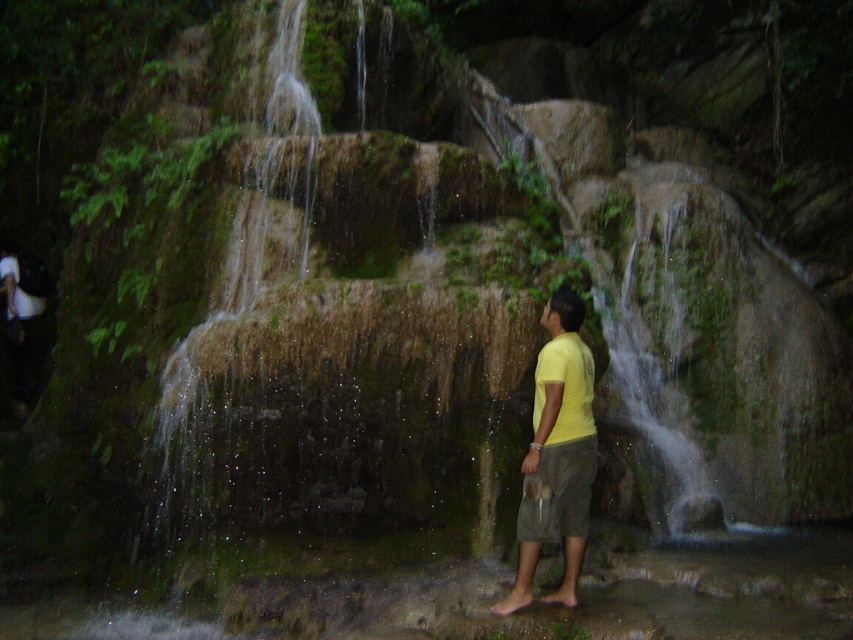
Question: Can you confirm if yellow matte shirt at center is positioned to the left of gray cotton shorts at center?

Choices:
 (A) yes
 (B) no

Answer: (A)

Question: Is yellow matte shirt at center positioned in front of gray cotton shorts at center?

Choices:
 (A) yes
 (B) no

Answer: (A)

Question: Which point is farther to the camera?

Choices:
 (A) yellow matte shirt at center
 (B) gray cotton shorts at center

Answer: (B)

Question: Does yellow matte shirt at center lie in front of gray cotton shorts at center?

Choices:
 (A) no
 (B) yes

Answer: (B)

Question: Which point is closer to the camera?

Choices:
 (A) (521, 548)
 (B) (572, 522)

Answer: (A)